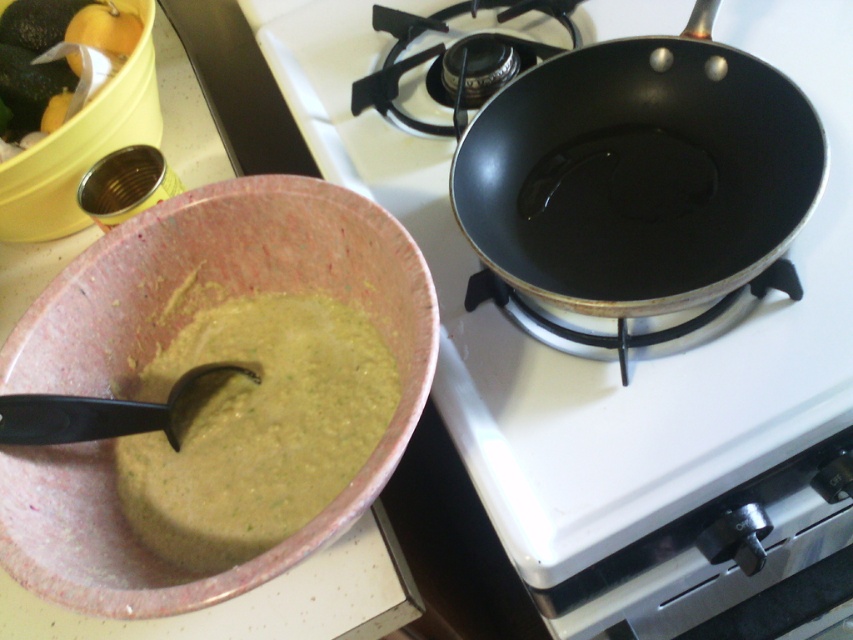
In the scene shown: You are a chef preparing a dish and need to place the pink speckled bowl containing greenish mixture on the left side of the image onto the counter near the gas stove. However, there is a black matte pan at upper right located at point coordinates (628,360). Can you safely place the bowl on the counter without it overlapping with the pan?

The point coordinates (628,360) indicate the location of the black matte pan at upper right. Since the bowl is on the left side of the image and the pan is at the upper right, there is sufficient space to place the bowl on the counter without overlapping with the pan.

You are a chef standing in front of the kitchen scene. You need to place a new spice jar between the two points marked as point [254,307] and point [167,394]. Which point should you place it closer to so that the spice jar is closer to the viewer?

You should place the spice jar closer to point [254,307] because it is further to the viewer than point [167,394].

You are holding a 24 inch ruler and want to measure the distance from the camera to the point at coordinates (804, 330). Can you reach it with your ruler?

The point at coordinates (804, 330) is 26.05 inches from the camera, so the ruler is 24 inches long which is shorter than the distance. Therefore, the ruler cannot reach the point.